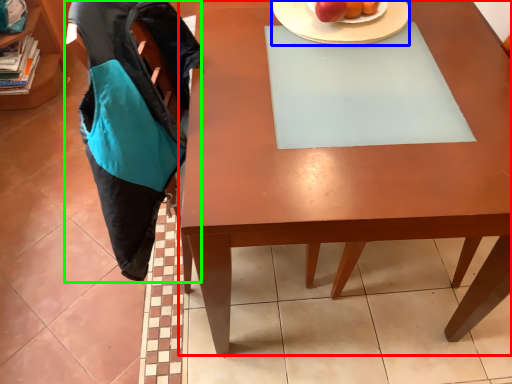
Question: Which object is positioned farthest from desk (highlighted by a red box)? Select from plate (highlighted by a blue box) and swivel chair (highlighted by a green box).

Choices:
 (A) plate
 (B) swivel chair

Answer: (A)